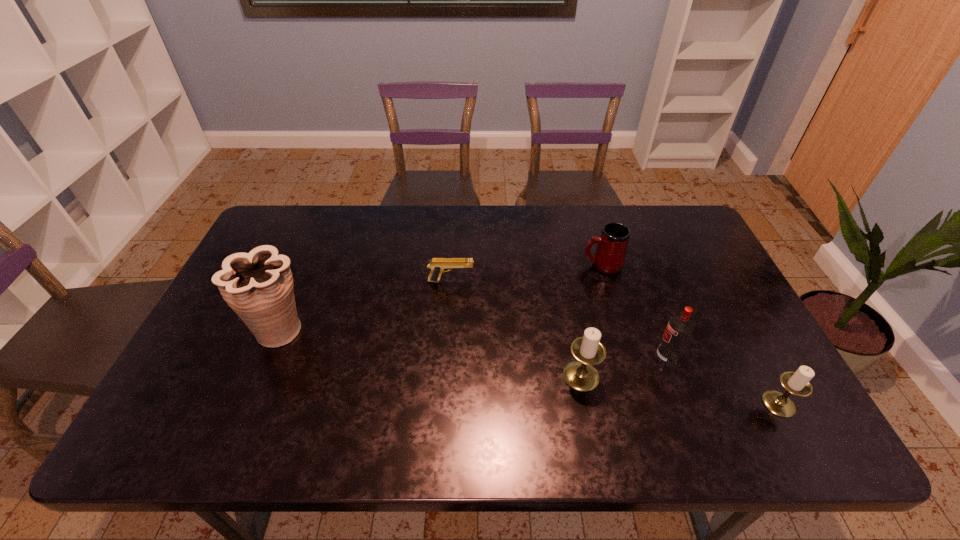
Please point a free position for a candle holder on the left. Please provide its 2D coordinates. Your answer should be formatted as a tuple, i.e. [(x, y)], where the tuple contains the x and y coordinates of a point satisfying the conditions above.

[(402, 351)]